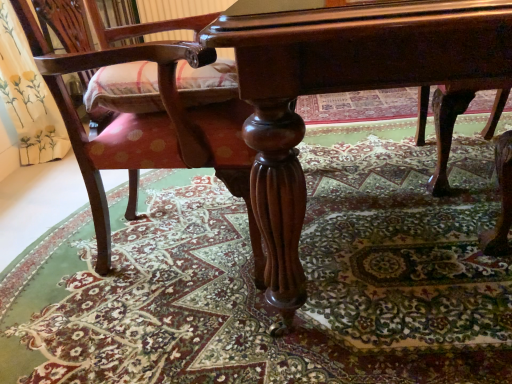
Question: Should I look upward or downward to see carpeted floor at center?

Choices:
 (A) up
 (B) down

Answer: (B)

Question: Does carpeted floor at center touch polished wood chair at lower left?

Choices:
 (A) no
 (B) yes

Answer: (A)

Question: Could polished wood chair at lower left be considered to be inside carpeted floor at center?

Choices:
 (A) no
 (B) yes

Answer: (A)

Question: Would you consider carpeted floor at center to be distant from polished wood chair at lower left?

Choices:
 (A) yes
 (B) no

Answer: (B)

Question: From a real-world perspective, is carpeted floor at center located beneath polished wood chair at lower left?

Choices:
 (A) no
 (B) yes

Answer: (B)

Question: Can you confirm if carpeted floor at center is wider than polished wood chair at lower left?

Choices:
 (A) no
 (B) yes

Answer: (B)

Question: Is carpeted floor at center shorter than polished wood chair at lower left?

Choices:
 (A) yes
 (B) no

Answer: (A)

Question: Considering the relative sizes of polished dark wood table at center and polished wood chair at lower left in the image provided, is polished dark wood table at center thinner than polished wood chair at lower left?

Choices:
 (A) yes
 (B) no

Answer: (B)

Question: Is polished dark wood table at center positioned beyond the bounds of polished wood chair at lower left?

Choices:
 (A) yes
 (B) no

Answer: (A)

Question: Considering the relative sizes of polished dark wood table at center and polished wood chair at lower left in the image provided, is polished dark wood table at center smaller than polished wood chair at lower left?

Choices:
 (A) no
 (B) yes

Answer: (A)

Question: From the image's perspective, does polished dark wood table at center appear lower than polished wood chair at lower left?

Choices:
 (A) yes
 (B) no

Answer: (B)

Question: Is polished dark wood table at center oriented towards polished wood chair at lower left?

Choices:
 (A) no
 (B) yes

Answer: (A)

Question: Is the position of polished dark wood table at center less distant than that of polished wood chair at lower left?

Choices:
 (A) yes
 (B) no

Answer: (A)

Question: Can you confirm if polished dark wood table at center is thinner than carpeted floor at center?

Choices:
 (A) yes
 (B) no

Answer: (A)